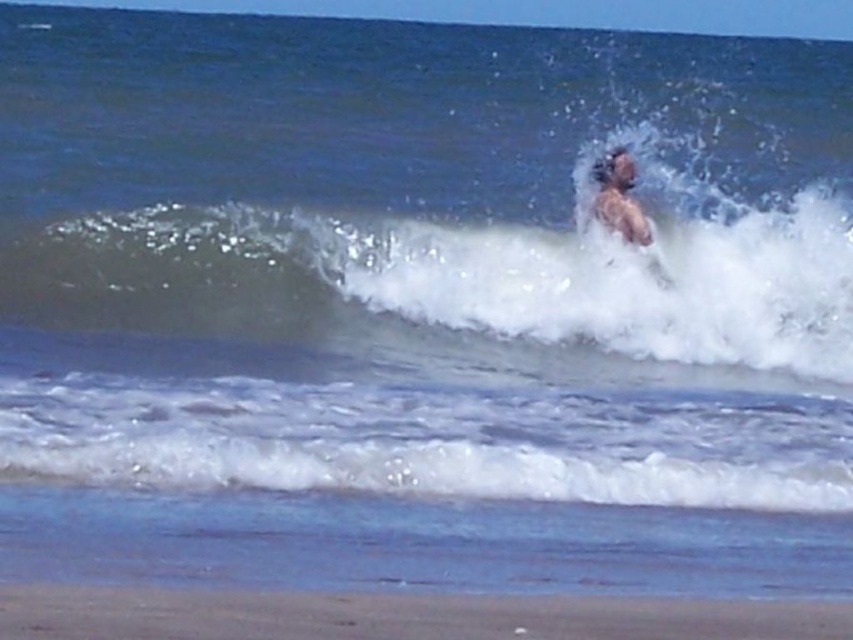
Question: Is white frothy wave at upper center closer to the viewer compared to smooth sand at lower center?

Choices:
 (A) yes
 (B) no

Answer: (B)

Question: Can you confirm if white frothy wave at upper center is thinner than smooth sand at lower center?

Choices:
 (A) no
 (B) yes

Answer: (B)

Question: Considering the real-world distances, which object is farthest from the light brown hair at upper center?

Choices:
 (A) white frothy wave at upper center
 (B) smooth sand at lower center

Answer: (B)

Question: Is smooth sand at lower center wider than light brown hair at upper center?

Choices:
 (A) no
 (B) yes

Answer: (B)

Question: Which of the following is the farthest from the observer?

Choices:
 (A) (460, 616)
 (B) (613, 228)
 (C) (242, 225)

Answer: (B)

Question: Which object is closer to the camera taking this photo?

Choices:
 (A) white frothy wave at upper center
 (B) smooth sand at lower center
 (C) light brown hair at upper center

Answer: (B)